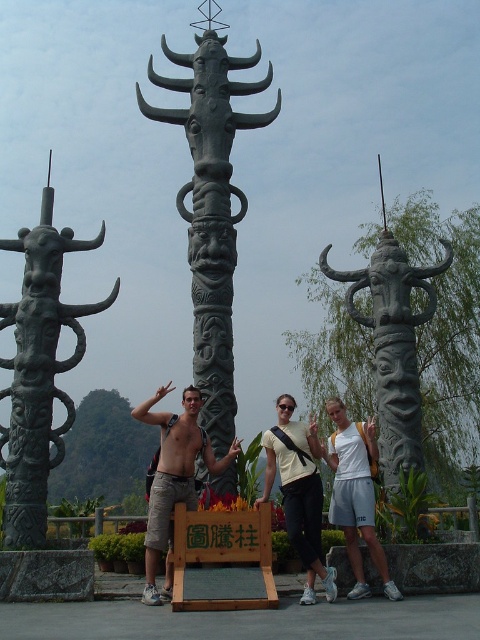
You are a photographer setting up a tripod to capture the scene. You need to ensure that the shiny silver statue at center and the white matte shirt at center are both in focus. Given their sizes, which object should you adjust the focus on first to ensure the smaller one is sharp?

The shiny silver statue at center is smaller than the white matte shirt at center, so you should focus on the shiny silver statue at center first to ensure its details are sharp before adjusting for the larger object.

You are standing in front of the pillars and want to place a small statue exactly at the point closer to you between the two points marked as point (x=197, y=413) and point (x=286, y=401). Which point should you choose?

You should choose point (x=197, y=413) because it is closer to the viewer than point (x=286, y=401).

You are a photographer adjusting your camera settings to capture the scene. You notice the shiny silver statue at center and the white matte shirt at center. Which object should you focus on first to ensure sharpness, considering their positions relative to the camera?

The shiny silver statue at center is closer to the viewer than the white matte shirt at center, so focusing on the shiny silver statue at center first will ensure it is sharp, and the white matte shirt at center may still be in focus depending on the depth of field.